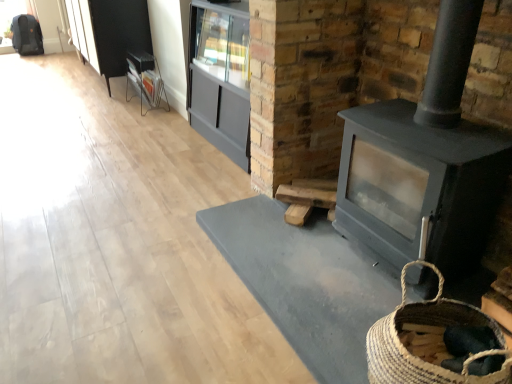
Question: From the image's perspective, is matte gray cabinet at center below metallic silver magazine rack at upper left?

Choices:
 (A) no
 (B) yes

Answer: (B)

Question: From a real-world perspective, is matte gray cabinet at center located higher than metallic silver magazine rack at upper left?

Choices:
 (A) no
 (B) yes

Answer: (B)

Question: From a real-world perspective, is matte gray cabinet at center located beneath metallic silver magazine rack at upper left?

Choices:
 (A) yes
 (B) no

Answer: (B)

Question: Is matte gray cabinet at center not close to metallic silver magazine rack at upper left?

Choices:
 (A) yes
 (B) no

Answer: (B)

Question: Considering the relative positions of matte gray cabinet at center and metallic silver magazine rack at upper left in the image provided, is matte gray cabinet at center behind metallic silver magazine rack at upper left?

Choices:
 (A) no
 (B) yes

Answer: (A)

Question: Is point (144, 59) closer or farther from the camera than point (372, 167)?

Choices:
 (A) closer
 (B) farther

Answer: (B)

Question: From a real-world perspective, is metallic silver magazine rack at upper left above or below matte gray wood burning stove at right?

Choices:
 (A) below
 (B) above

Answer: (A)

Question: Based on their positions, is metallic silver magazine rack at upper left located to the left or right of matte gray wood burning stove at right?

Choices:
 (A) left
 (B) right

Answer: (A)

Question: From their relative heights in the image, would you say metallic silver magazine rack at upper left is taller or shorter than matte gray wood burning stove at right?

Choices:
 (A) short
 (B) tall

Answer: (A)

Question: Is matte gray cabinet at center to the left or to the right of matte gray wood burning stove at right in the image?

Choices:
 (A) right
 (B) left

Answer: (B)

Question: Considering the positions of point (209, 74) and point (440, 226), is point (209, 74) closer or farther from the camera than point (440, 226)?

Choices:
 (A) farther
 (B) closer

Answer: (A)

Question: From the image's perspective, is matte gray cabinet at center above or below matte gray wood burning stove at right?

Choices:
 (A) below
 (B) above

Answer: (B)

Question: In terms of height, does matte gray cabinet at center look taller or shorter compared to matte gray wood burning stove at right?

Choices:
 (A) tall
 (B) short

Answer: (B)

Question: In terms of size, does metallic silver magazine rack at upper left appear bigger or smaller than natural woven basket at lower right?

Choices:
 (A) big
 (B) small

Answer: (B)

Question: Looking at their shapes, would you say metallic silver magazine rack at upper left is wider or thinner than natural woven basket at lower right?

Choices:
 (A) thin
 (B) wide

Answer: (A)